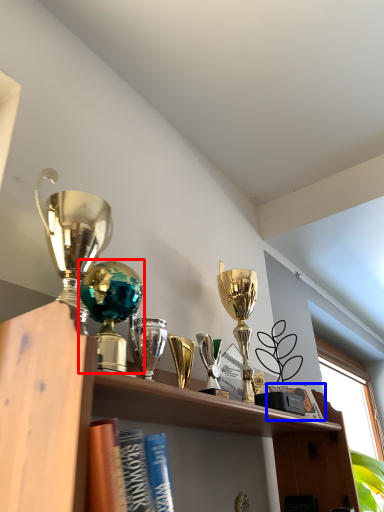
Question: Among these objects, which one is farthest to the camera, trophy (highlighted by a red box) or book (highlighted by a blue box)?

Choices:
 (A) trophy
 (B) book

Answer: (B)